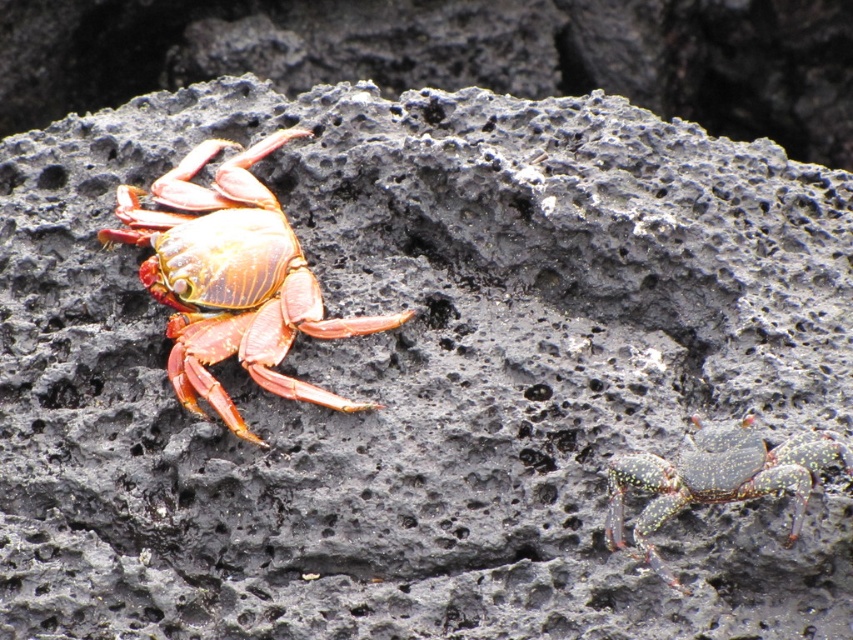
Who is more forward, (223, 326) or (723, 440)?

Point (723, 440) is in front.

Can you confirm if shiny orange crab at left is shorter than shiny metallic crab at lower right?

In fact, shiny orange crab at left may be taller than shiny metallic crab at lower right.

I want to click on shiny orange crab at left, so click(x=231, y=280).

The image size is (853, 640). In order to click on shiny orange crab at left in this screenshot , I will do 231,280.